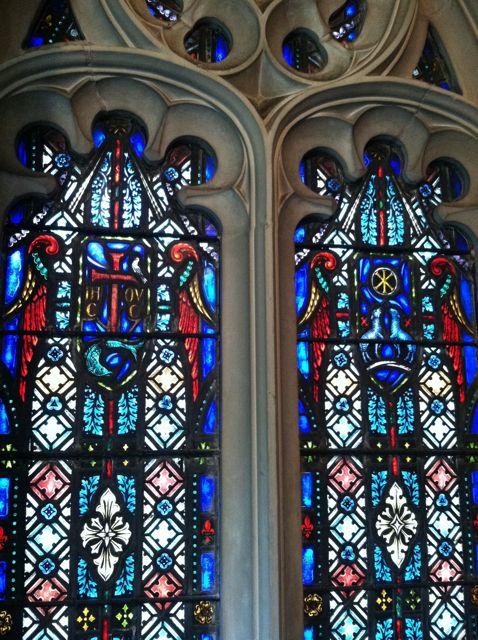
Find the location of a particular element. Image resolution: width=478 pixels, height=640 pixels. wall is located at coordinates pos(262,102).